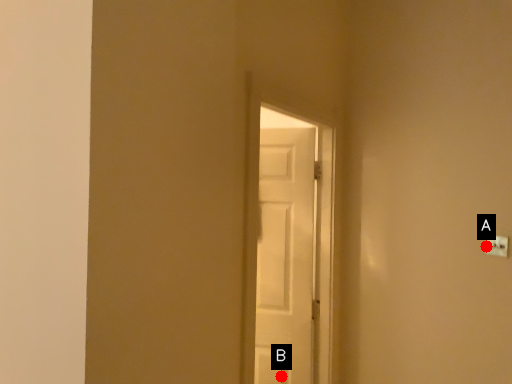
Question: Two points are circled on the image, labeled by A and B beside each circle. Among these points, which one is nearest to the camera?

Choices:
 (A) A is closer
 (B) B is closer

Answer: (A)